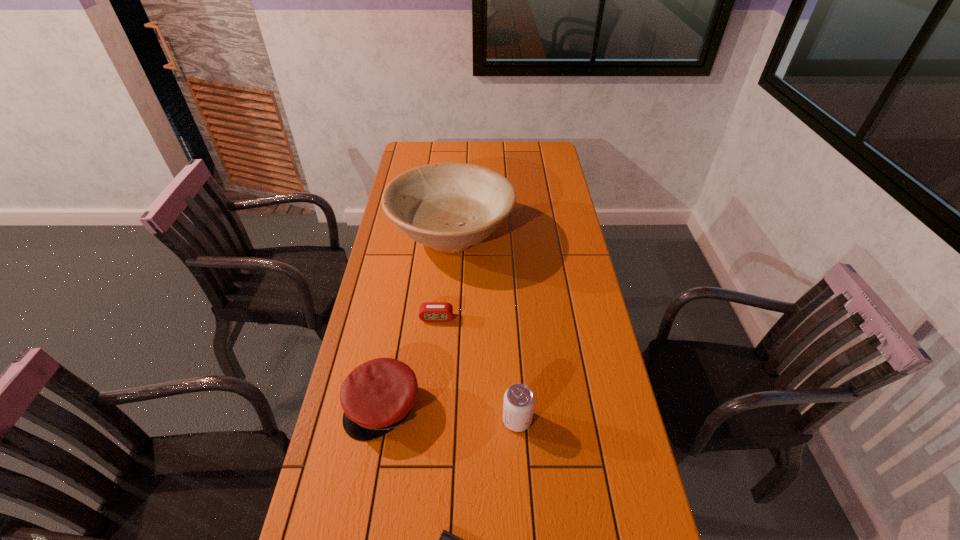
The width and height of the screenshot is (960, 540). Find the location of `dish located in the left edge section of the desktop`. dish located in the left edge section of the desktop is located at coordinates (449, 206).

The width and height of the screenshot is (960, 540). Identify the location of cap positioned at the left edge. (377, 396).

This screenshot has height=540, width=960. In the image, there is a desktop. Find the location of `vacant space at the far edge`. vacant space at the far edge is located at coordinates (471, 152).

Locate an element on the screen. This screenshot has width=960, height=540. free space at the left edge of the desktop is located at coordinates (364, 329).

This screenshot has height=540, width=960. In order to click on free space at the right edge of the desktop in this screenshot , I will do `click(576, 383)`.

This screenshot has width=960, height=540. In order to click on vacant space at the far right corner of the desktop in this screenshot , I will do (x=552, y=143).

At what (x,y) coordinates should I click in order to perform the action: click on free space that is in between the fourth nearest object and the cap. Please return your answer as a coordinate pair (x, y). Looking at the image, I should click on (410, 362).

The height and width of the screenshot is (540, 960). Identify the location of vacant space in between the cap and the soda can. (450, 413).

The height and width of the screenshot is (540, 960). In order to click on vacant space that's between the third tallest object and the fourth tallest object in this screenshot , I will do pos(410,362).

The width and height of the screenshot is (960, 540). I want to click on empty space that is in between the cap and the soda can, so click(x=450, y=413).